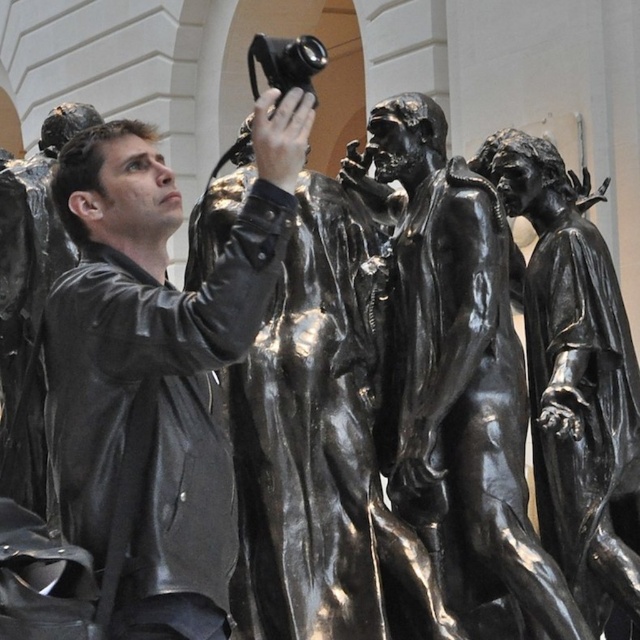
Question: Can you confirm if black polished bronze figures at center is positioned above bronze statue at center?

Choices:
 (A) yes
 (B) no

Answer: (B)

Question: Does black polished bronze figures at center appear on the right side of shiny bronze statue at center?

Choices:
 (A) yes
 (B) no

Answer: (B)

Question: Which of the following is the closest to the observer?

Choices:
 (A) shiny bronze statue at center
 (B) bronze statue at center

Answer: (B)

Question: Which point is farther from the camera taking this photo?

Choices:
 (A) 424,115
 (B) 586,268

Answer: (B)

Question: Estimate the real-world distances between objects in this image. Which object is farther from the shiny bronze statue at center?

Choices:
 (A) black leather jacket at center
 (B) bronze statue at center

Answer: (B)

Question: Does black leather jacket at center appear on the right side of shiny bronze statue at center?

Choices:
 (A) yes
 (B) no

Answer: (B)